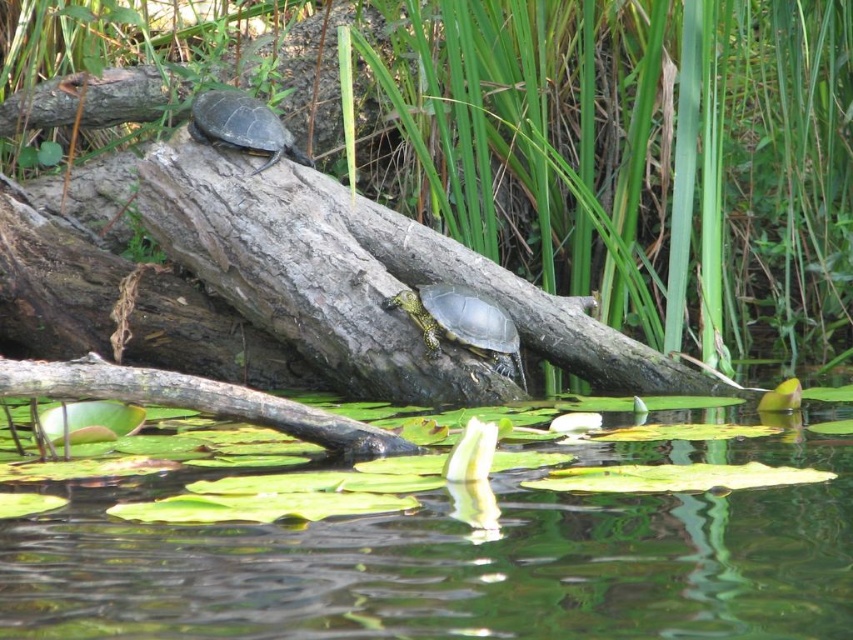
You are a photographer aiming to capture a closeup shot of the shiny dark green tortoise at upper left without including the green leafy vegetation at upper center in the frame. Is this possible based on their positions?

The green leafy vegetation at upper center is above the shiny dark green tortoise at upper left, so it would block the view. To avoid including the vegetation, the photographer would need to adjust the angle or position to exclude the vegetation above.

You are a photographer aiming to capture a clear shot of the shiny green tortoise at center without the green leafy vegetation at upper center blocking it. What adjustment should you make to your camera angle?

Lower your camera angle so that the shiny green tortoise at center is framed below the green leafy vegetation at upper center, allowing the tortoise to be visible without obstruction.

You are a photographer trying to capture both the green leafy vegetation at upper center and the shiny green tortoise at center in a single frame. Which object occupies a larger portion of the image horizontally?

→ The green leafy vegetation at upper center is wider than the shiny green tortoise at center, so it occupies a larger horizontal portion in the image.